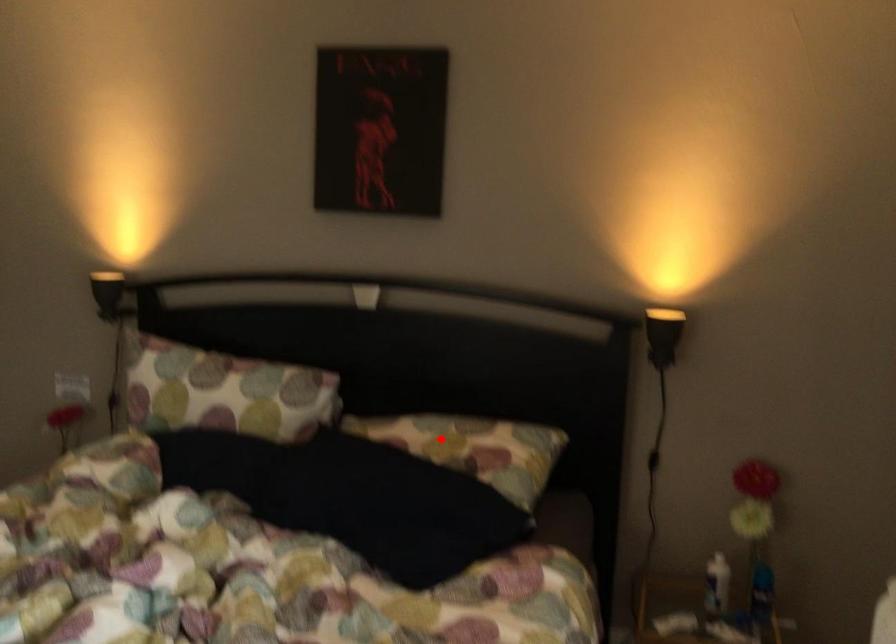
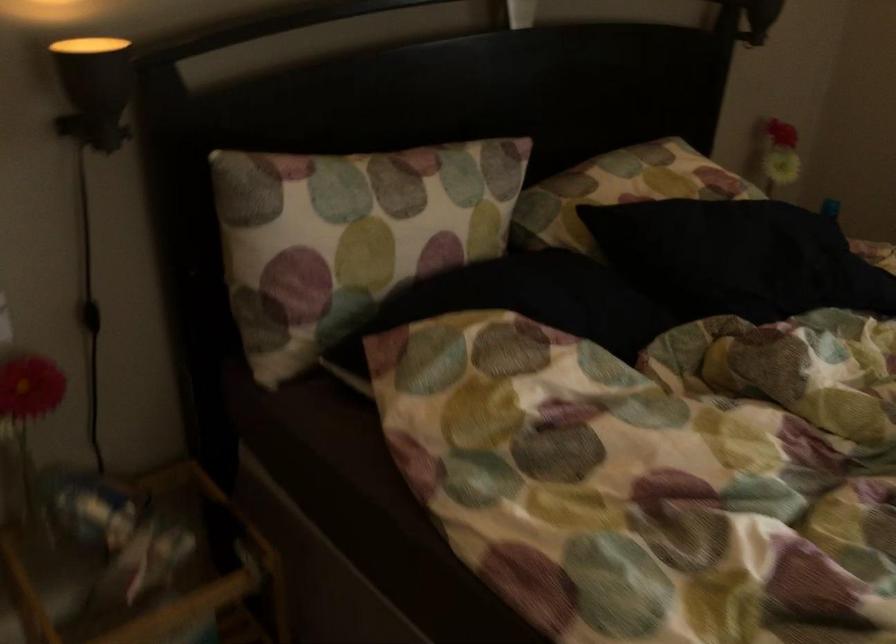
Question: I am providing you with two images of the same scene from different viewpoints. A red point is shown in image1. For the corresponding object point in image2, is it positioned nearer or farther from the camera?

Choices:
 (A) Nearer
 (B) Farther

Answer: (A)